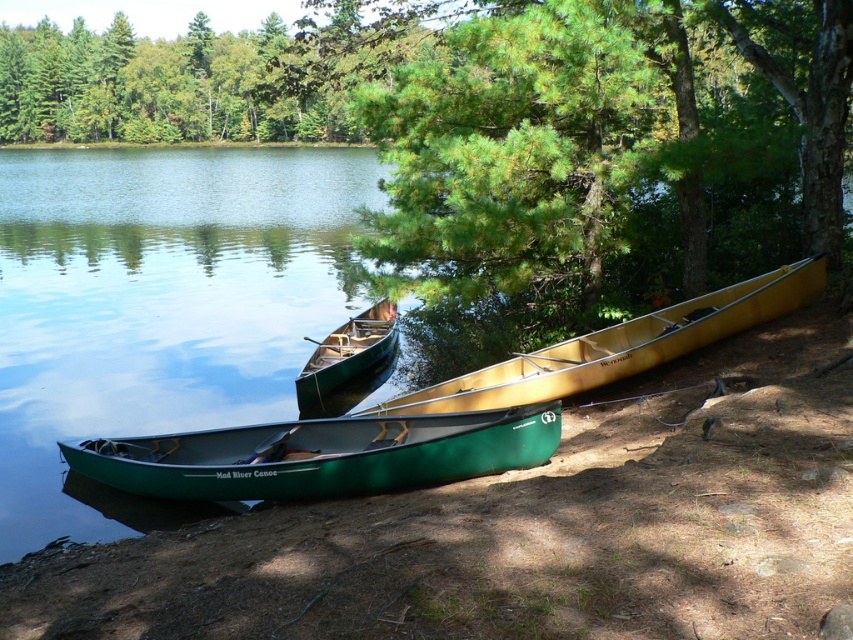
Measure the distance between green pine tree at center and green leafy trees at upper center.

green pine tree at center and green leafy trees at upper center are 16.94 meters apart.

Find the location of `green pine tree at center`. green pine tree at center is located at coordinates (579, 129).

Find the location of a particular element. This screenshot has height=640, width=853. green pine tree at center is located at coordinates (579, 129).

Does green leafy trees at upper center appear over green polished wood canoe at center?

Indeed, green leafy trees at upper center is positioned over green polished wood canoe at center.

Which of these two, green leafy trees at upper center or green polished wood canoe at center, stands shorter?

With less height is green polished wood canoe at center.

Which is in front, point (4, 72) or point (339, 410)?

Positioned in front is point (339, 410).

This screenshot has width=853, height=640. I want to click on green leafy trees at upper center, so click(155, 86).

Does point (225, 68) lie in front of point (561, 365)?

No, it is behind (561, 365).

Who is positioned more to the right, green leafy trees at upper center or matte yellow canoe at center?

Positioned to the right is matte yellow canoe at center.

Does point (102, 64) come behind point (730, 307)?

Yes, it is.

This screenshot has width=853, height=640. I want to click on green leafy trees at upper center, so click(155, 86).